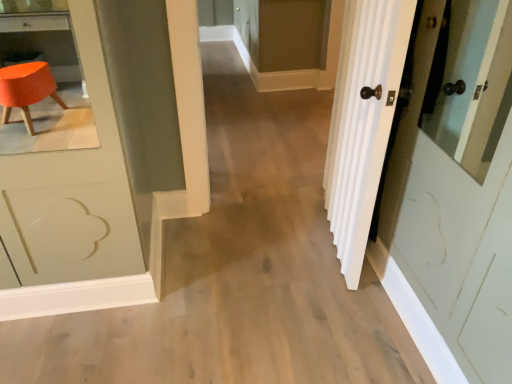
Question: From a real-world perspective, is matte brown screen door at upper center physically located above or below white wood door at right?

Choices:
 (A) below
 (B) above

Answer: (A)

Question: Looking at the image, does matte brown screen door at upper center seem bigger or smaller compared to white wood door at right?

Choices:
 (A) small
 (B) big

Answer: (B)

Question: From the image's perspective, relative to white wood door at right, is matte brown screen door at upper center above or below?

Choices:
 (A) below
 (B) above

Answer: (B)

Question: From a real-world perspective, is white wood door at right above or below matte brown screen door at upper center?

Choices:
 (A) above
 (B) below

Answer: (A)

Question: Is white wood door at right situated inside matte brown screen door at upper center or outside?

Choices:
 (A) inside
 (B) outside

Answer: (B)

Question: Is white wood door at right wider or thinner than matte brown screen door at upper center?

Choices:
 (A) wide
 (B) thin

Answer: (B)

Question: From the image's perspective, is white wood door at right located above or below matte brown screen door at upper center?

Choices:
 (A) above
 (B) below

Answer: (B)